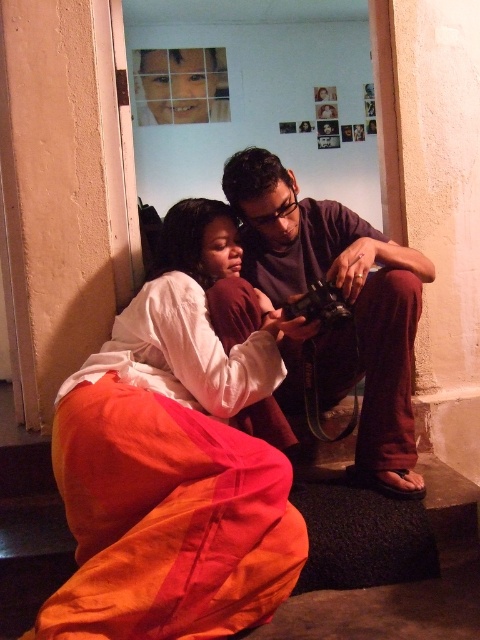
Question: Does orange cotton pants at lower left have a larger size compared to dark purple shirt at center?

Choices:
 (A) no
 (B) yes

Answer: (B)

Question: Which point is farther from the camera taking this photo?

Choices:
 (A) (256, 205)
 (B) (205, 394)

Answer: (A)

Question: Is orange cotton pants at lower left further to camera compared to dark purple shirt at center?

Choices:
 (A) yes
 (B) no

Answer: (B)

Question: Which of the following is the closest to the observer?

Choices:
 (A) orange cotton pants at lower left
 (B) dark purple shirt at center

Answer: (A)

Question: Does orange cotton pants at lower left lie behind dark purple shirt at center?

Choices:
 (A) yes
 (B) no

Answer: (B)